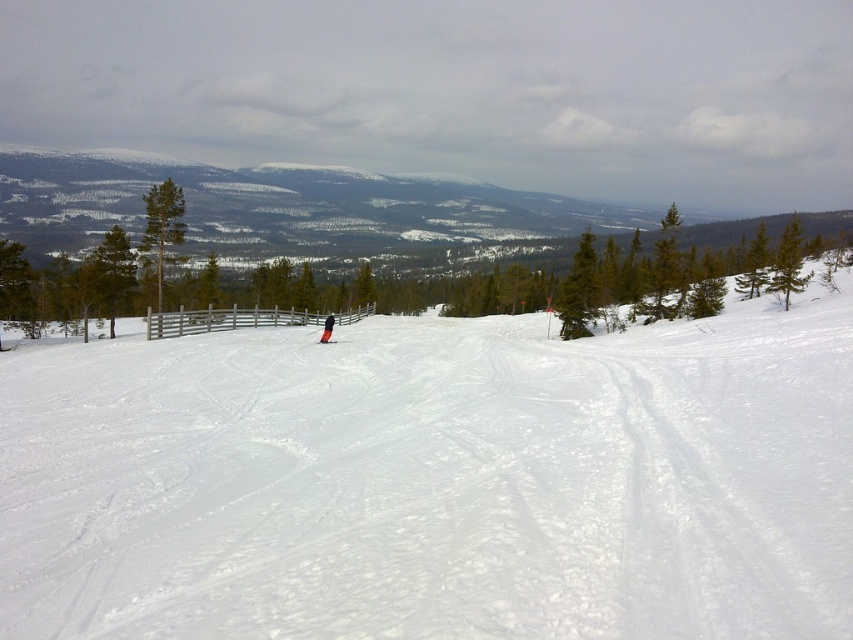
Question: Considering the real-world distances, which object is farthest from the orange fabric ski at center?

Choices:
 (A) black fabric person at center
 (B) white powdery snow at center

Answer: (B)

Question: Can you confirm if white powdery snow at center is positioned below orange fabric ski at center?

Choices:
 (A) yes
 (B) no

Answer: (A)

Question: Estimate the real-world distances between objects in this image. Which object is closer to the orange fabric ski at center?

Choices:
 (A) black fabric person at center
 (B) white powdery snow at center

Answer: (A)

Question: Does black fabric person at center lie behind orange fabric ski at center?

Choices:
 (A) yes
 (B) no

Answer: (A)

Question: Which point is farther to the camera?

Choices:
 (A) white powdery snow at center
 (B) orange fabric ski at center

Answer: (B)

Question: Does black fabric person at center appear over orange fabric ski at center?

Choices:
 (A) no
 (B) yes

Answer: (B)